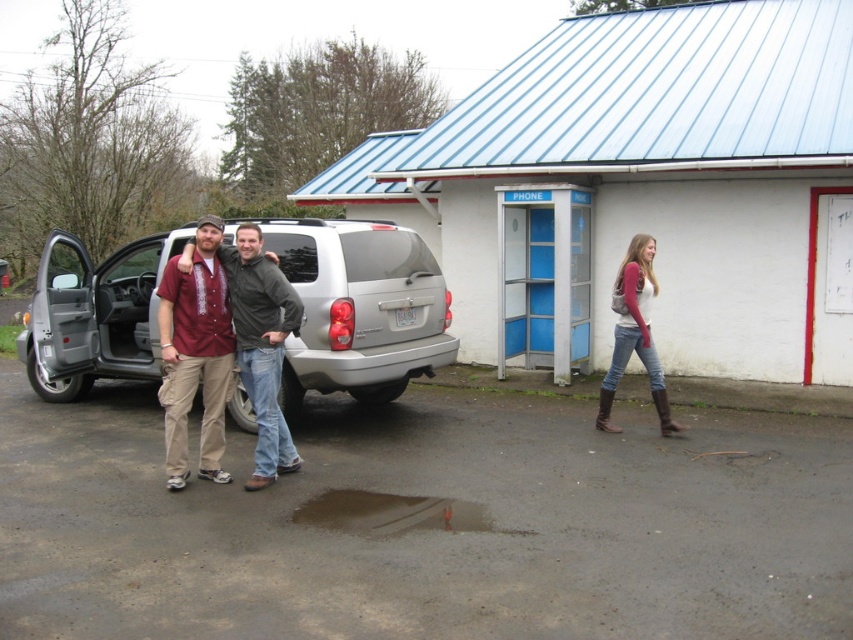
You are a photographer setting up a shot of the silver metallic suv at center and the denim jeans at right. To ensure both subjects are in frame, which direction should you move the camera? Explain your reasoning based on their positions.

The silver metallic suv at center is positioned on the left side of denim jeans at right. To include both in the frame, move the camera to the right so that the suv at center and denim jeans at right are centered or aligned within the camera view.

You are a delivery driver who needs to park your van in a space that can only accommodate vehicles up to the size of the brown matte puddle at lower center. Based on the scene, can your van fit in the parking space if the silver metallic suv at center is currently occupying it?

The silver metallic suv at center is wider than the brown matte puddle at lower center, so if the parking space can only fit a vehicle as large as the puddle, the van would not fit in the space occupied by the SUV.